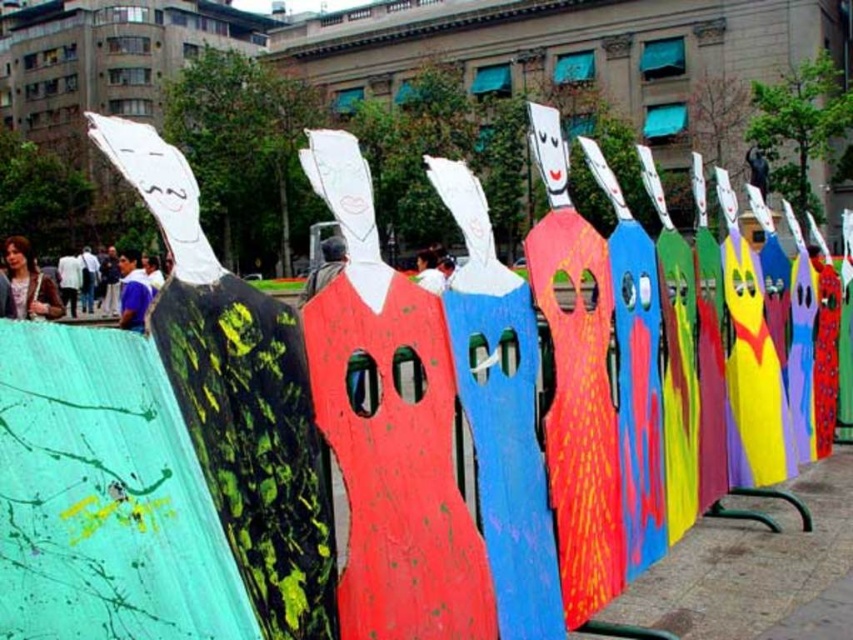
Question: Is matte brown hair at left bigger than matte gray jacket at center?

Choices:
 (A) no
 (B) yes

Answer: (B)

Question: Does blue cotton shirt at center have a greater width compared to white cotton shirt at center?

Choices:
 (A) yes
 (B) no

Answer: (A)

Question: Is matte brown hair at left to the left of matte gray jacket at center from the viewer's perspective?

Choices:
 (A) yes
 (B) no

Answer: (A)

Question: Which point appears farthest from the camera in this image?

Choices:
 (A) (318, 282)
 (B) (59, 310)
 (C) (74, 269)
 (D) (138, 273)

Answer: (C)

Question: Which of the following is the farthest from the observer?

Choices:
 (A) matte gray jacket at center
 (B) matte brown hair at left
 (C) white cotton shirt at center
 (D) blue cotton shirt at center

Answer: (C)

Question: Which object is positioned closest to the matte brown hair at left?

Choices:
 (A) matte gray jacket at center
 (B) white cotton shirt at center
 (C) blue cotton shirt at center

Answer: (C)